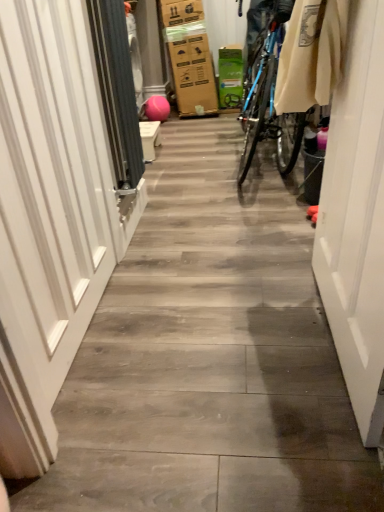
Question: Is white glossy door at right at the left side of white glossy door at left?

Choices:
 (A) yes
 (B) no

Answer: (B)

Question: From a real-world perspective, is white glossy door at right physically below white glossy door at left?

Choices:
 (A) no
 (B) yes

Answer: (B)

Question: Is white glossy door at right wider than white glossy door at left?

Choices:
 (A) no
 (B) yes

Answer: (A)

Question: Is white glossy door at right to the right of white glossy door at left from the viewer's perspective?

Choices:
 (A) yes
 (B) no

Answer: (A)

Question: Does white glossy door at right come behind white glossy door at left?

Choices:
 (A) no
 (B) yes

Answer: (A)

Question: From the image's perspective, is white glossy door at right above or below gray fabric screen door at left?

Choices:
 (A) above
 (B) below

Answer: (B)

Question: Is white glossy door at right bigger or smaller than gray fabric screen door at left?

Choices:
 (A) big
 (B) small

Answer: (A)

Question: From a real-world perspective, is white glossy door at right physically located above or below gray fabric screen door at left?

Choices:
 (A) above
 (B) below

Answer: (B)

Question: Is point (324, 259) positioned closer to the camera than point (132, 118)?

Choices:
 (A) closer
 (B) farther

Answer: (A)

Question: Based on their positions, is gray fabric screen door at left located to the left or right of white glossy door at left?

Choices:
 (A) right
 (B) left

Answer: (A)

Question: Is point (127, 188) positioned closer to the camera than point (54, 248)?

Choices:
 (A) farther
 (B) closer

Answer: (A)

Question: From a real-world perspective, is gray fabric screen door at left positioned above or below white glossy door at left?

Choices:
 (A) above
 (B) below

Answer: (A)

Question: In terms of width, does gray fabric screen door at left look wider or thinner when compared to white glossy door at left?

Choices:
 (A) wide
 (B) thin

Answer: (B)

Question: Is gray fabric screen door at left in front of or behind white glossy door at right in the image?

Choices:
 (A) behind
 (B) front

Answer: (A)

Question: Is point (112, 162) closer or farther from the camera than point (349, 270)?

Choices:
 (A) closer
 (B) farther

Answer: (B)